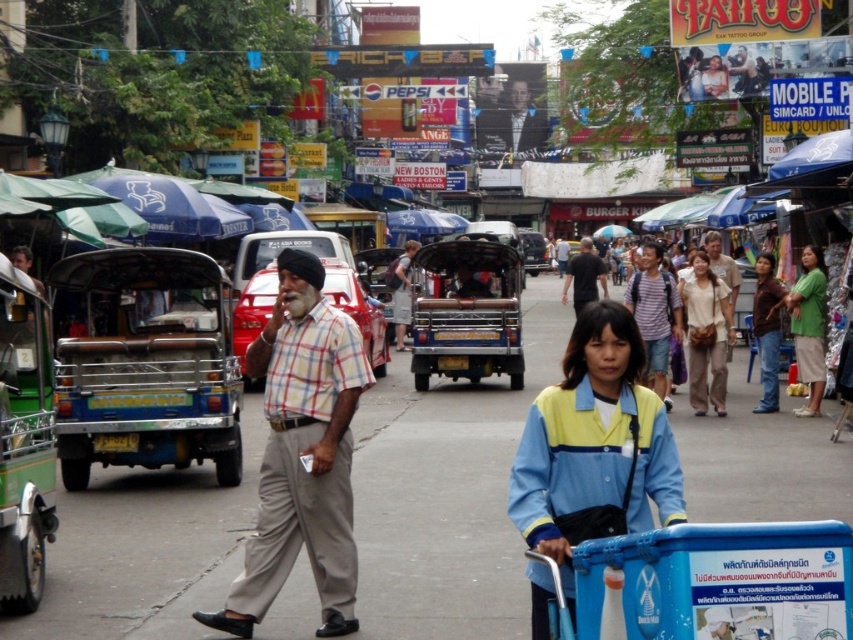
Which of these two, light blue fabric shirt at center or striped fabric shirt at center, stands shorter?

light blue fabric shirt at center is shorter.

At what (x,y) coordinates should I click in order to perform the action: click on light blue fabric shirt at center. Please return your answer as a coordinate pair (x, y). The height and width of the screenshot is (640, 853). Looking at the image, I should click on (595, 445).

Consider the image. Is light blue fabric shirt at center bigger than green cotton shirt at right?

Incorrect, light blue fabric shirt at center is not larger than green cotton shirt at right.

Does point (531, 458) lie in front of point (813, 257)?

That is True.

Between point (541, 509) and point (815, 392), which one is positioned in front?

Point (541, 509) is in front.

Find the location of `light blue fabric shirt at center`. light blue fabric shirt at center is located at coordinates (595, 445).

Does plaid shirt at center appear on the left side of dark gray shirt at center?

Correct, you'll find plaid shirt at center to the left of dark gray shirt at center.

Consider the image. Who is taller, plaid shirt at center or dark gray shirt at center?

dark gray shirt at center

Who is more forward, (344,556) or (573,294)?

Positioned in front is point (344,556).

The height and width of the screenshot is (640, 853). Find the location of `plaid shirt at center`. plaid shirt at center is located at coordinates (302, 452).